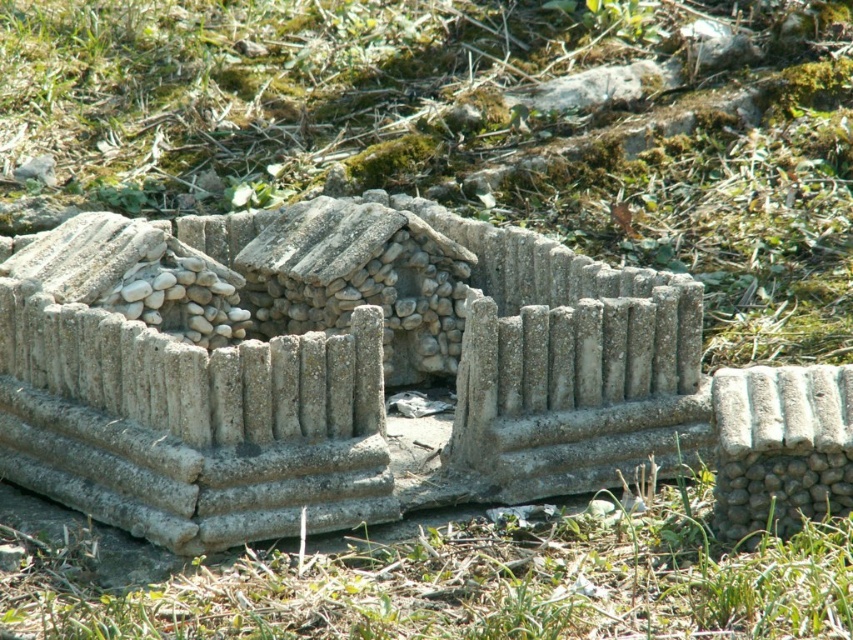
Question: Which of the following is the farthest from the observer?

Choices:
 (A) green grass at center
 (B) green grass at lower center

Answer: (A)

Question: Can you confirm if gray concrete fence at center is positioned to the right of green grass at lower center?

Choices:
 (A) no
 (B) yes

Answer: (A)

Question: Which object is the closest to the green grass at lower center?

Choices:
 (A) gray concrete fence at center
 (B) green grass at center

Answer: (A)

Question: Can you confirm if green grass at center is positioned to the left of gray concrete fence at center?

Choices:
 (A) no
 (B) yes

Answer: (A)

Question: Is green grass at center behind gray concrete fence at center?

Choices:
 (A) yes
 (B) no

Answer: (A)

Question: Among these points, which one is nearest to the camera?

Choices:
 (A) (686, 436)
 (B) (183, 204)

Answer: (A)